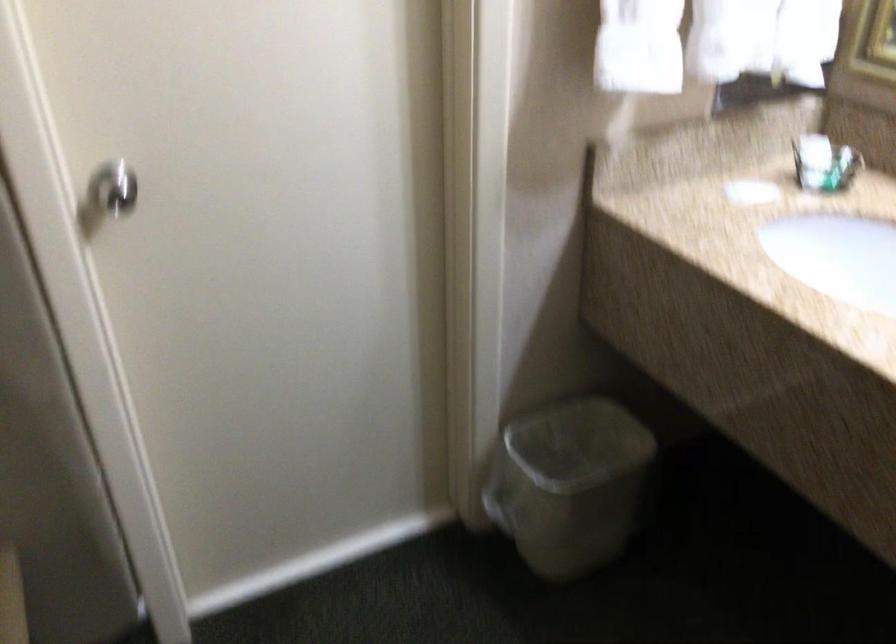
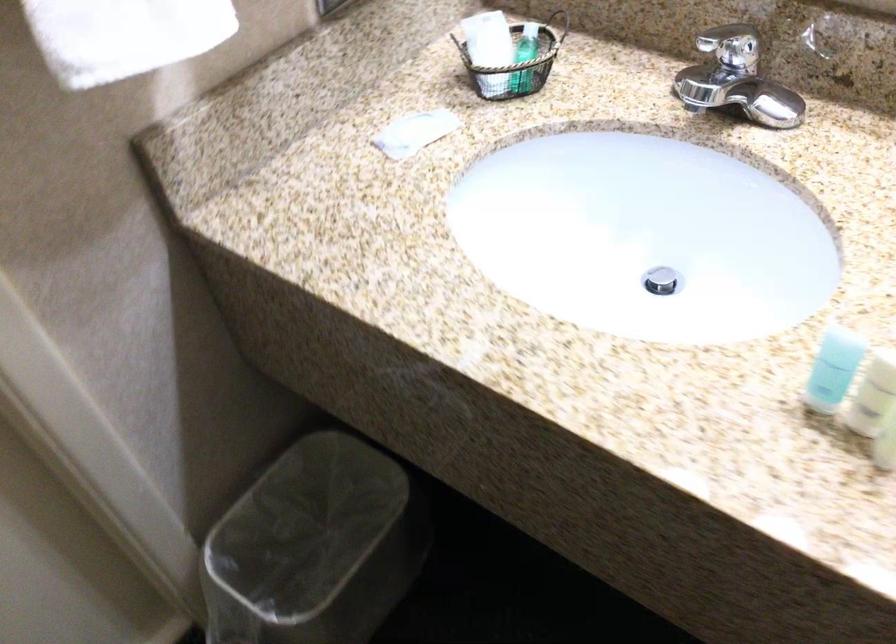
The images are taken continuously from a first-person perspective. In which direction are you moving?

The movement direction of the cameraman is right, forward.